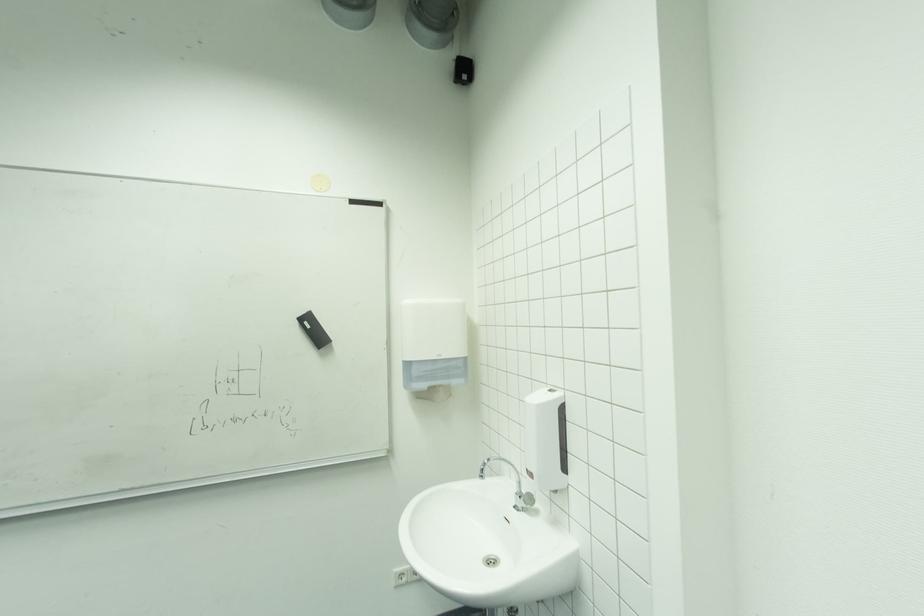
What do you see at coordinates (404, 575) in the screenshot?
I see `a electrical outlet` at bounding box center [404, 575].